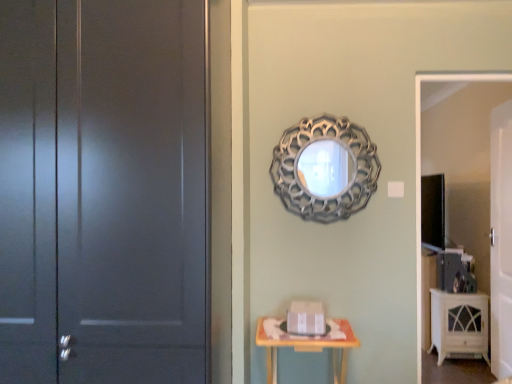
Question: Is matte gray door at left, the first door when ordered from front to back, shorter than silver metallic mirror at upper center?

Choices:
 (A) yes
 (B) no

Answer: (B)

Question: Does matte gray door at left, the first door viewed from the left, have a larger size compared to silver metallic mirror at upper center?

Choices:
 (A) no
 (B) yes

Answer: (B)

Question: Is matte gray door at left, the first door viewed from the left, next to silver metallic mirror at upper center and touching it?

Choices:
 (A) no
 (B) yes

Answer: (A)

Question: Is matte gray door at left, which is counted as the 2th door, starting from the right, not within silver metallic mirror at upper center?

Choices:
 (A) yes
 (B) no

Answer: (A)

Question: Is matte gray door at left, which is counted as the 2th door, starting from the right, positioned before silver metallic mirror at upper center?

Choices:
 (A) yes
 (B) no

Answer: (A)

Question: Considering the positions of point 472,311 and point 98,221, is point 472,311 closer or farther from the camera than point 98,221?

Choices:
 (A) farther
 (B) closer

Answer: (A)

Question: Based on their sizes in the image, would you say white glossy cabinet at lower right is bigger or smaller than matte gray door at left, the second door in the back-to-front sequence?

Choices:
 (A) big
 (B) small

Answer: (B)

Question: Choose the correct answer: Is white glossy cabinet at lower right inside matte gray door at left, the second door in the back-to-front sequence, or outside it?

Choices:
 (A) outside
 (B) inside

Answer: (A)

Question: From a real-world perspective, relative to matte gray door at left, which is counted as the 2th door, starting from the right, is white glossy cabinet at lower right vertically above or below?

Choices:
 (A) above
 (B) below

Answer: (B)

Question: Is white glossy cabinet at lower right inside the boundaries of white glossy tv stand at right, or outside?

Choices:
 (A) outside
 (B) inside

Answer: (A)

Question: From the image's perspective, relative to white glossy tv stand at right, is white glossy cabinet at lower right above or below?

Choices:
 (A) below
 (B) above

Answer: (A)

Question: Considering the positions of point (439, 326) and point (417, 259), is point (439, 326) closer or farther from the camera than point (417, 259)?

Choices:
 (A) closer
 (B) farther

Answer: (B)

Question: From a real-world perspective, is white glossy cabinet at lower right positioned above or below white glossy tv stand at right?

Choices:
 (A) above
 (B) below

Answer: (B)

Question: Considering the positions of wooden table at lower center and white glossy door at right, which is the first door in right-to-left order, in the image, is wooden table at lower center wider or thinner than white glossy door at right, which is the first door in right-to-left order,?

Choices:
 (A) wide
 (B) thin

Answer: (A)

Question: From the image's perspective, is wooden table at lower center located above or below white glossy door at right, the first door when ordered from back to front?

Choices:
 (A) below
 (B) above

Answer: (A)